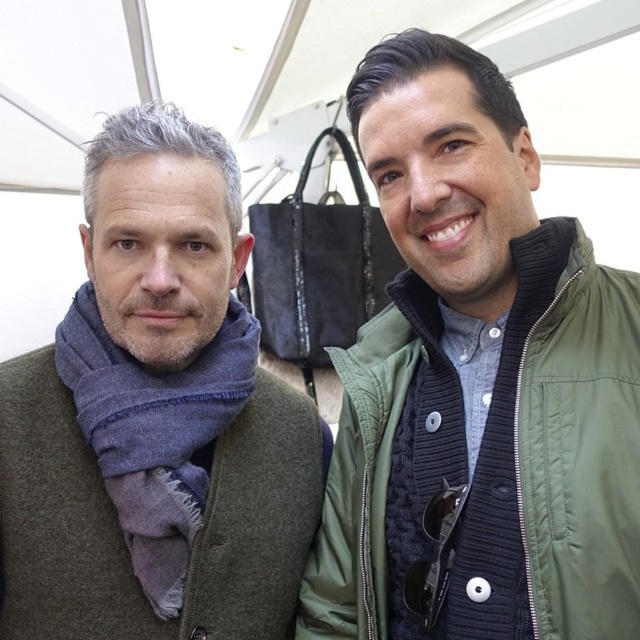
Question: Does green matte jacket at center appear on the left side of blue wool scarf at left?

Choices:
 (A) yes
 (B) no

Answer: (B)

Question: Which object appears farthest from the camera in this image?

Choices:
 (A) green matte jacket at center
 (B) blue wool scarf at left

Answer: (B)

Question: Which point is closer to the camera?

Choices:
 (A) blue woolen scarf at left
 (B) blue wool scarf at left
 (C) green matte jacket at center

Answer: (C)

Question: Does blue wool scarf at left have a larger size compared to blue woolen scarf at left?

Choices:
 (A) no
 (B) yes

Answer: (B)

Question: Is green matte jacket at center above blue wool scarf at left?

Choices:
 (A) no
 (B) yes

Answer: (B)

Question: Which point appears farthest from the camera in this image?

Choices:
 (A) (627, 337)
 (B) (36, 355)
 (C) (148, 385)

Answer: (B)